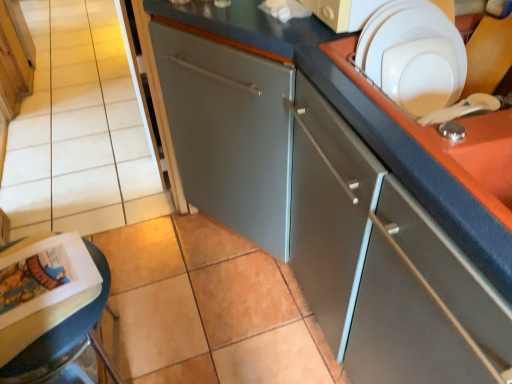
Identify the location of empty space that is ontop of matte paper magazine at lower left (from a real-world perspective). Image resolution: width=512 pixels, height=384 pixels. (30, 285).